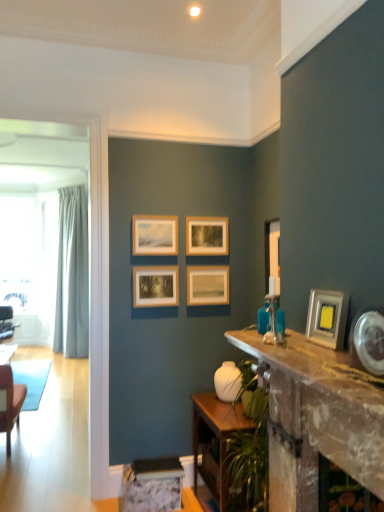
This screenshot has height=512, width=384. What are the coordinates of `free space to the left of metallic silver picture frame at right, the 6th picture frame from the back` in the screenshot? It's located at (292, 345).